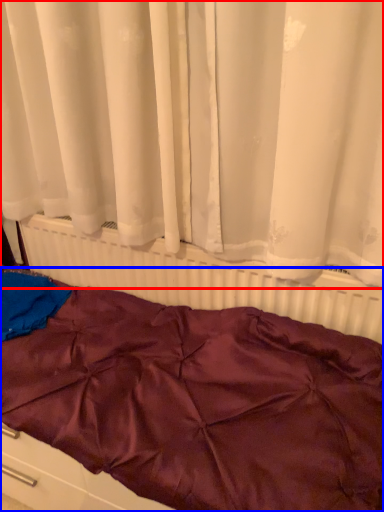
Question: Among these objects, which one is farthest to the camera, curtain (highlighted by a red box) or furniture (highlighted by a blue box)?

Choices:
 (A) curtain
 (B) furniture

Answer: (B)